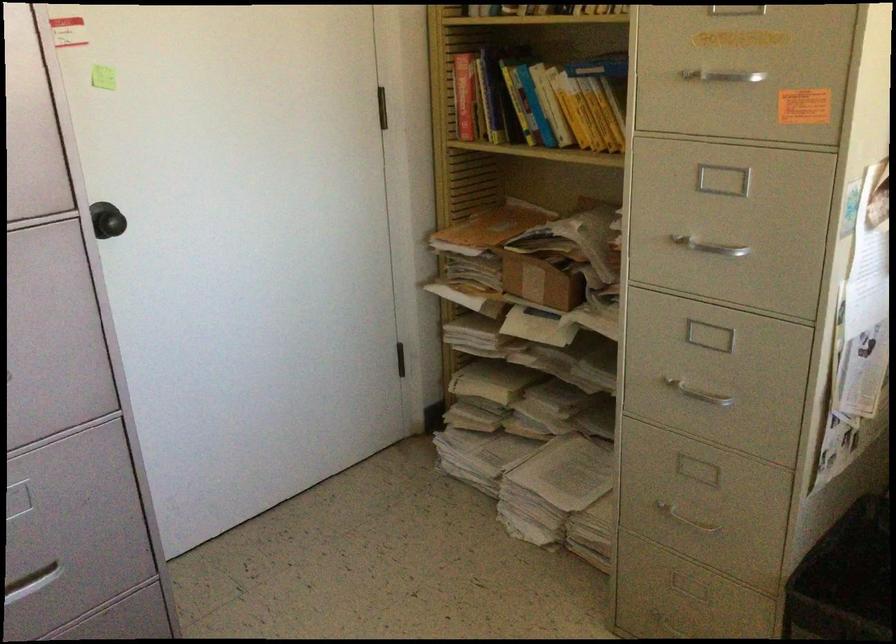
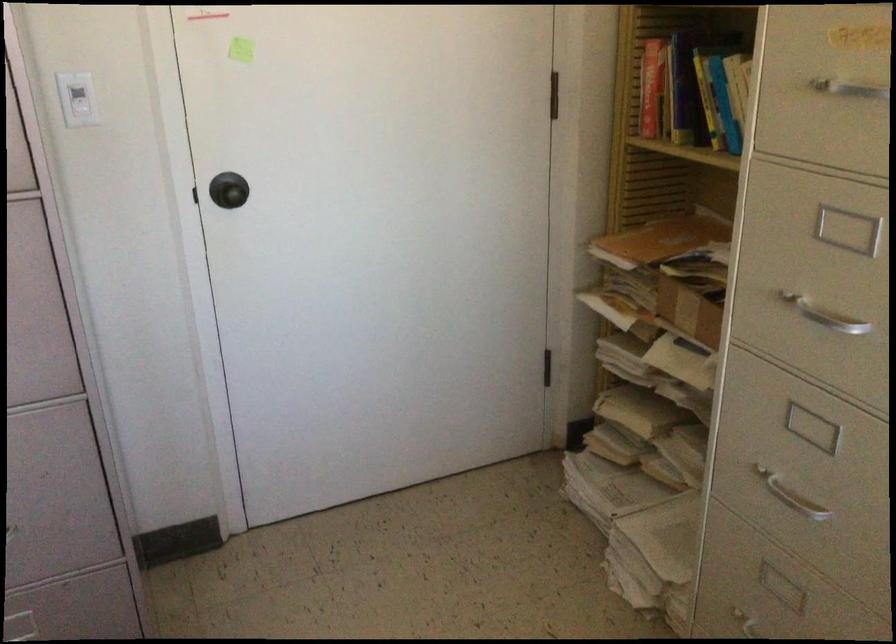
Where in the second image is the point corresponding to point (696, 389) from the first image?

(790, 496)